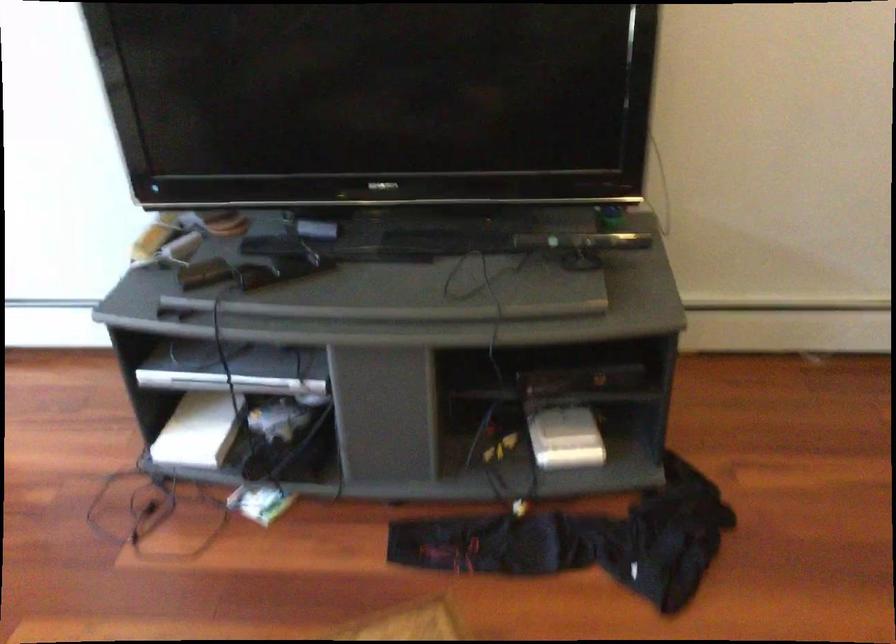
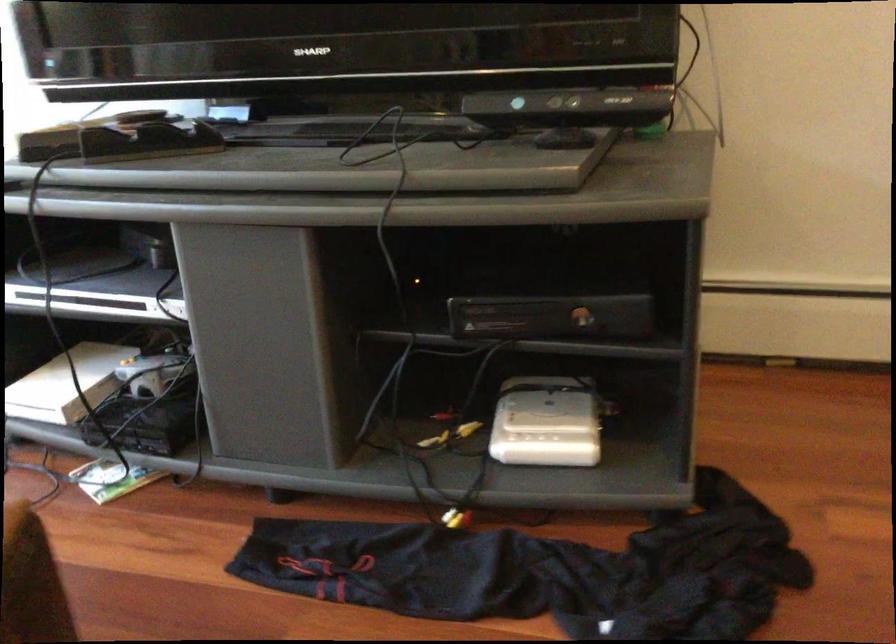
Question: How did the camera likely rotate?

Choices:
 (A) Left
 (B) Right
 (C) Up
 (D) Down

Answer: (A)